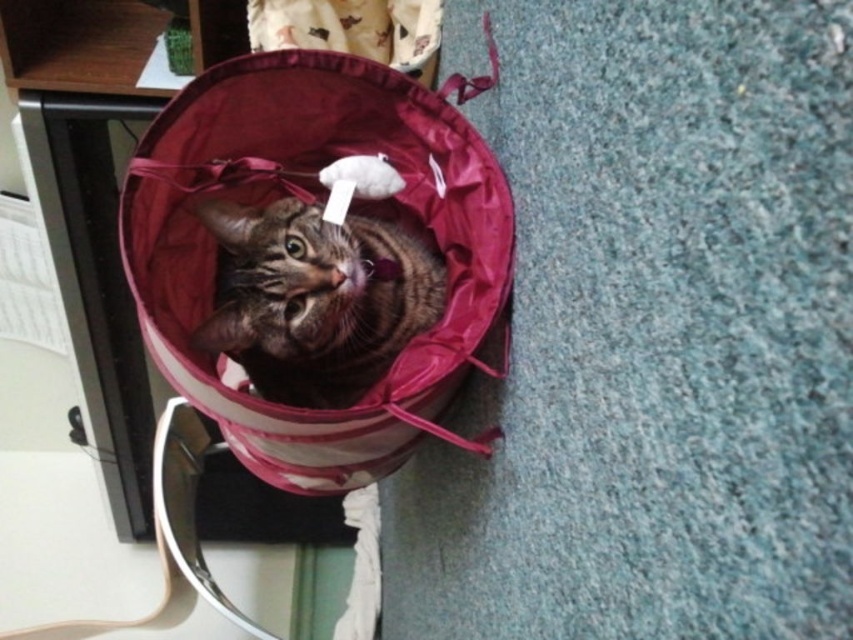
Question: Does velvet-like maroon cat bed at center have a lesser width compared to tabby fur cat at center?

Choices:
 (A) yes
 (B) no

Answer: (B)

Question: Which object is farther from the camera taking this photo?

Choices:
 (A) velvet-like maroon cat bed at center
 (B) tabby fur cat at center

Answer: (B)

Question: Observing the image, what is the correct spatial positioning of velvet-like maroon cat bed at center in reference to tabby fur cat at center?

Choices:
 (A) below
 (B) above

Answer: (B)

Question: Which object is closer to the camera taking this photo?

Choices:
 (A) tabby fur cat at center
 (B) velvet-like maroon cat bed at center

Answer: (B)

Question: From the image, what is the correct spatial relationship of velvet-like maroon cat bed at center in relation to tabby fur cat at center?

Choices:
 (A) left
 (B) right

Answer: (A)